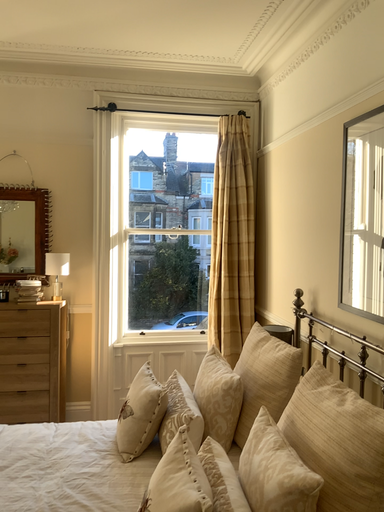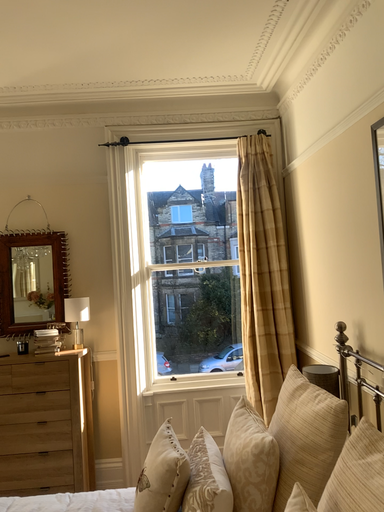
Question: Which way did the camera rotate in the video?

Choices:
 (A) rotated right
 (B) rotated left

Answer: (B)